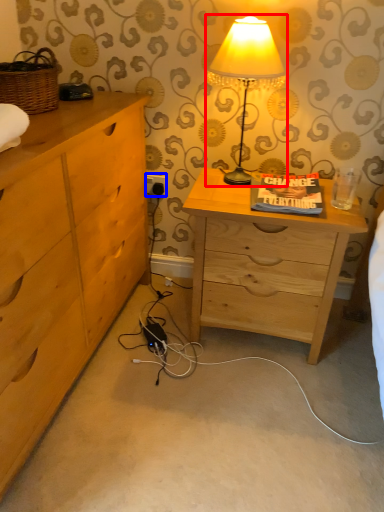
Question: Which object appears closest to the camera in this image, lamp (highlighted by a red box) or electric outlet (highlighted by a blue box)?

Choices:
 (A) lamp
 (B) electric outlet

Answer: (A)